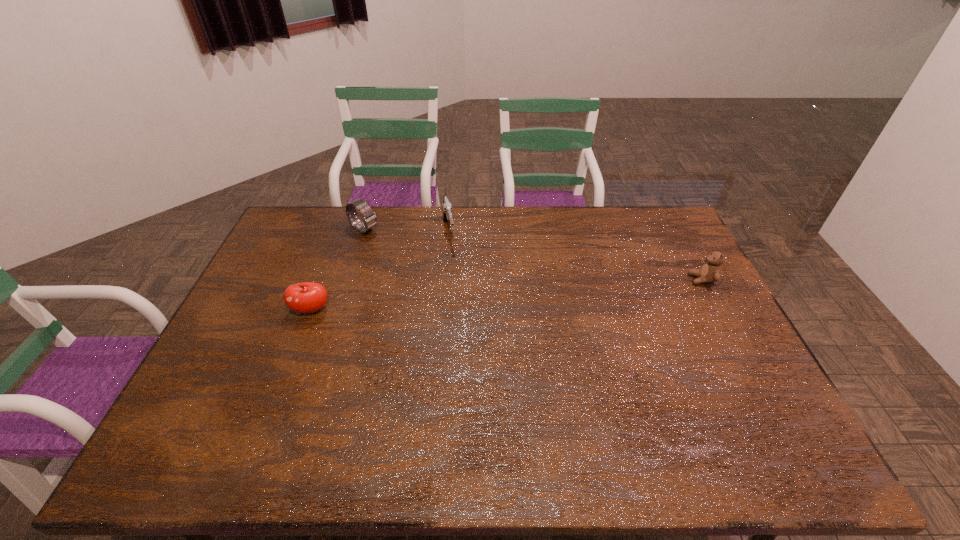
Find the location of a particular element. blank region between the watch and the second object from right to left is located at coordinates (406, 231).

The image size is (960, 540). In order to click on empty space between the apple and the gun in this screenshot , I will do `click(380, 271)`.

Where is `vacant area that lies between the second object from right to left and the watch`? The image size is (960, 540). vacant area that lies between the second object from right to left and the watch is located at coordinates (406, 231).

I want to click on unoccupied area between the apple and the watch, so click(338, 270).

Identify the location of free spot between the nearest object and the teddy bear. (507, 295).

Locate which object ranks second in proximity to the second object from right to left. Please provide its 2D coordinates. Your answer should be formatted as a tuple, i.e. [(x, y)], where the tuple contains the x and y coordinates of a point satisfying the conditions above.

[(307, 297)]

Where is `object that is the third closest to the nearest object`? The width and height of the screenshot is (960, 540). object that is the third closest to the nearest object is located at coordinates (710, 272).

Locate an element on the screen. The image size is (960, 540). vacant space that satisfies the following two spatial constraints: 1. on the front side of the second nearest object; 2. on the front-facing side of the watch is located at coordinates (348, 279).